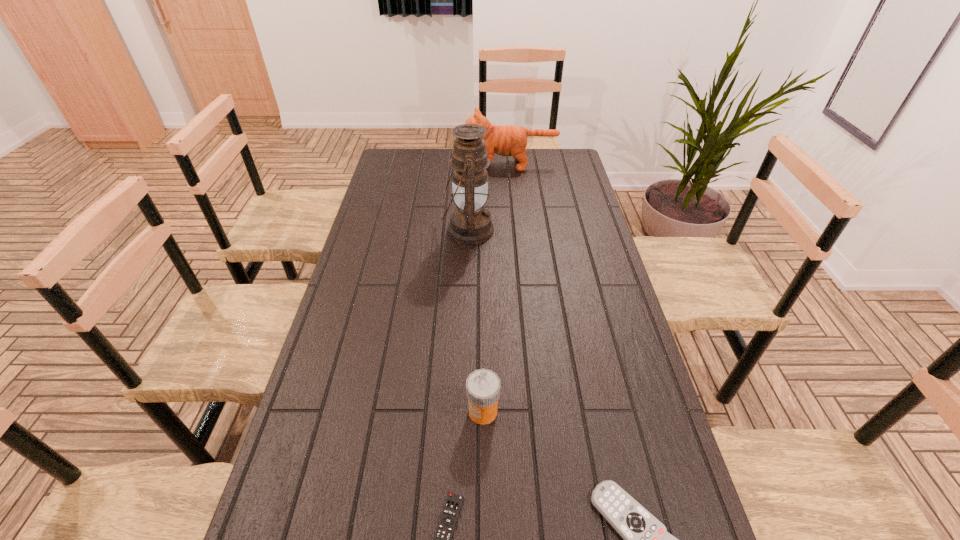
The width and height of the screenshot is (960, 540). Find the location of `vacant space located 0.090m on the label side of the third nearest object`. vacant space located 0.090m on the label side of the third nearest object is located at coordinates (430, 411).

Find the location of a particular element. free space located on the label side of the third nearest object is located at coordinates (439, 411).

Locate an element on the screen. vacant space positioned 0.260m on the label side of the third nearest object is located at coordinates (361, 411).

Identify the location of object positioned at the far edge. (507, 140).

Find the location of a particular element. object located in the right edge section of the desktop is located at coordinates (507, 140).

At what (x,y) coordinates should I click in order to perform the action: click on object located at the far right corner. Please return your answer as a coordinate pair (x, y). The height and width of the screenshot is (540, 960). Looking at the image, I should click on (507, 140).

Identify the location of vacant space at the far edge of the desktop. Image resolution: width=960 pixels, height=540 pixels. (431, 148).

This screenshot has width=960, height=540. In the image, there is a desktop. Find the location of `vacant space at the left edge`. vacant space at the left edge is located at coordinates (354, 359).

Identify the location of free location at the right edge of the desktop. (585, 186).

What are the coordinates of `free space at the far right corner` in the screenshot? It's located at (548, 152).